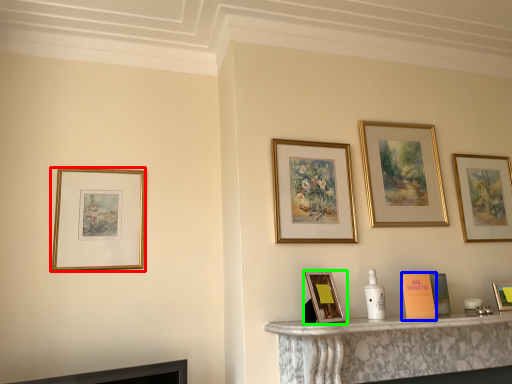
Question: Which object is positioned closest to picture frame (highlighted by a red box)? Select from book (highlighted by a blue box) and picture frame (highlighted by a green box).

Choices:
 (A) book
 (B) picture frame

Answer: (B)